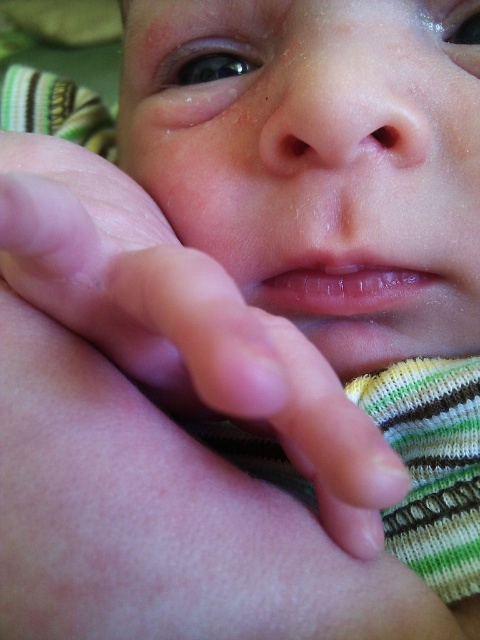
Question: Among these objects, which one is farthest from the camera?

Choices:
 (A) pink flesh at center
 (B) smooth skin baby at center

Answer: (B)

Question: Which point appears farthest from the camera in this image?

Choices:
 (A) (168, 356)
 (B) (146, 180)

Answer: (B)

Question: Is smooth skin baby at center positioned in front of pink flesh at center?

Choices:
 (A) no
 (B) yes

Answer: (A)

Question: Can you confirm if smooth skin baby at center is positioned below pink flesh at center?

Choices:
 (A) yes
 (B) no

Answer: (B)

Question: Can you confirm if smooth skin baby at center is positioned to the left of pink flesh at center?

Choices:
 (A) yes
 (B) no

Answer: (B)